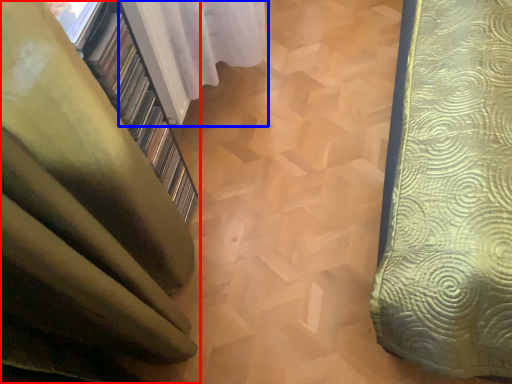
Question: Which object appears farthest to the camera in this image, curtain (highlighted by a red box) or curtain (highlighted by a blue box)?

Choices:
 (A) curtain
 (B) curtain

Answer: (B)